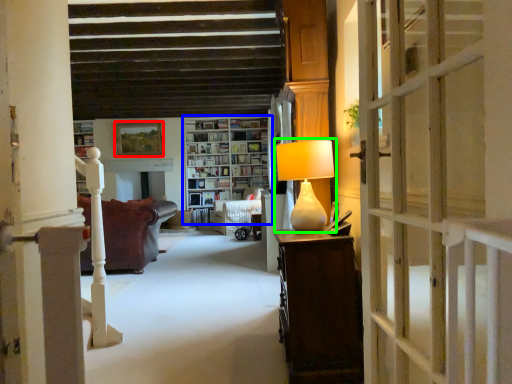
Question: Considering the real-world distances, which object is closest to picture frame (highlighted by a red box)? bookcase (highlighted by a blue box) or table lamp (highlighted by a green box).

Choices:
 (A) bookcase
 (B) table lamp

Answer: (A)